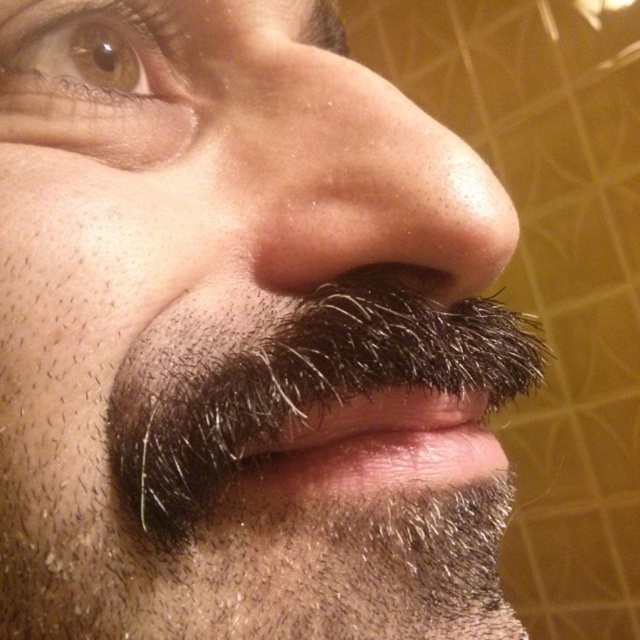
You are a makeup artist preparing to apply foundation on a client. The client has a smooth skin nose at center and dark brown fur at center. Given that your brush is 5 centimeters wide, can you apply the foundation between these two features without overlapping them?

The distance between the smooth skin nose at center and dark brown fur at center is 6.34 centimeters. Since the brush is only 5 centimeters wide, it cannot cover the entire space between them without overlapping one of the features.

You are an artist sketching the person in the image. You want to add details to the brown matte eye at upper left and the dark brown fur at center. Which area requires more space on your paper?

The dark brown fur at center requires more space because it occupies more area than the brown matte eye at upper left.